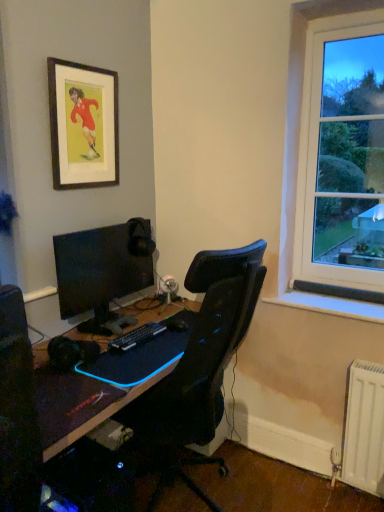
The width and height of the screenshot is (384, 512). What are the coordinates of `free space in front of black plastic keyboard at center` in the screenshot? It's located at (136, 360).